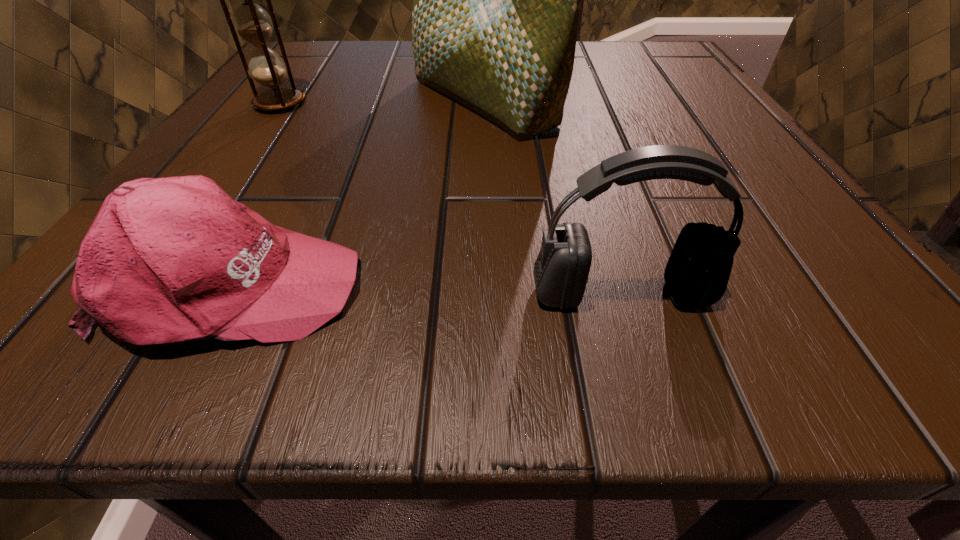
At what (x,y) coordinates should I click in order to perform the action: click on the tallest object. Please return your answer as a coordinate pair (x, y). Image resolution: width=960 pixels, height=540 pixels. Looking at the image, I should click on (496, 0).

Where is `hourglass`? This screenshot has height=540, width=960. hourglass is located at coordinates (251, 21).

You are a GUI agent. You are given a task and a screenshot of the screen. Output one action in this format:
    pyautogui.click(x=<x>, y=<y>)
    Task: Click on the headset
    This screenshot has width=960, height=540.
    Given the screenshot: What is the action you would take?
    pyautogui.click(x=697, y=273)

The height and width of the screenshot is (540, 960). Identify the location of the shortest object. (174, 259).

Image resolution: width=960 pixels, height=540 pixels. Find the location of `free space located 0.160m on the left of the tallest object`. free space located 0.160m on the left of the tallest object is located at coordinates coord(308,102).

Locate an element on the screen. This screenshot has width=960, height=540. vacant space situated on the back of the hourglass is located at coordinates (323, 43).

Image resolution: width=960 pixels, height=540 pixels. In order to click on vacant area situated at the front of the baseball cap with the brim in this screenshot , I will do `click(782, 285)`.

This screenshot has width=960, height=540. In order to click on shopping bag situated at the far edge in this screenshot , I will do `click(496, 0)`.

Identify the location of hourglass at the far edge. This screenshot has width=960, height=540. (251, 21).

The height and width of the screenshot is (540, 960). Find the location of `headset that is at the near edge`. headset that is at the near edge is located at coordinates (697, 273).